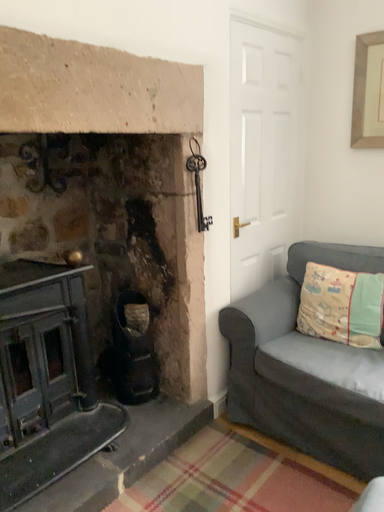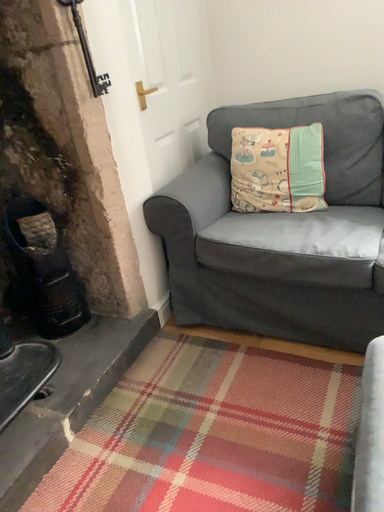
Question: Which way did the camera rotate in the video?

Choices:
 (A) rotated upward
 (B) rotated downward

Answer: (B)